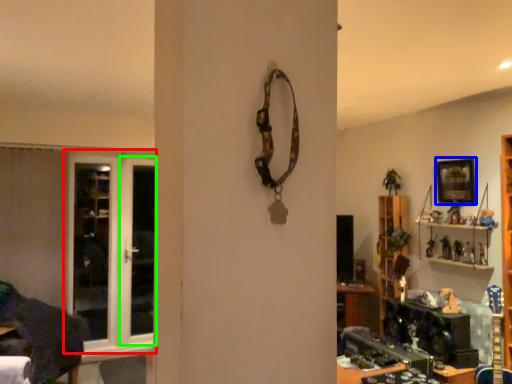
Question: Which is nearer to the door (highlighted by a red box)? picture frame (highlighted by a blue box) or screen door (highlighted by a green box).

Choices:
 (A) picture frame
 (B) screen door

Answer: (B)